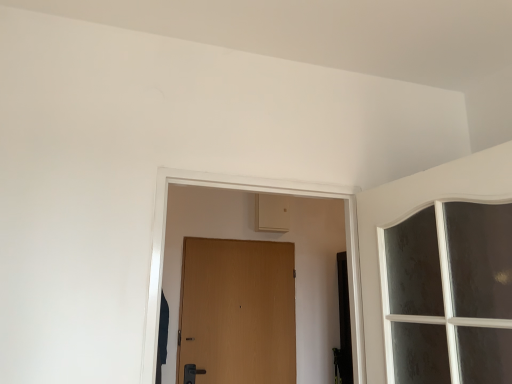
Locate an element on the screen. The image size is (512, 384). wooden door at center is located at coordinates (238, 311).

Describe the element at coordinates (238, 311) in the screenshot. The height and width of the screenshot is (384, 512). I see `wooden door at center` at that location.

Where is `white textured glass window at upper right`? The height and width of the screenshot is (384, 512). white textured glass window at upper right is located at coordinates (449, 295).

Describe the element at coordinates (449, 295) in the screenshot. I see `white textured glass window at upper right` at that location.

Where is `wooden door at center`? The height and width of the screenshot is (384, 512). wooden door at center is located at coordinates (238, 311).

Between wooden door at center and white textured glass window at upper right, which one appears on the right side from the viewer's perspective?

white textured glass window at upper right.

Which object is further away from the camera taking this photo, wooden door at center or white textured glass window at upper right?

wooden door at center is more distant.

Is point (294, 328) behind point (397, 296)?

Yes, it is.

From the image's perspective, which is below, wooden door at center or white textured glass window at upper right?

wooden door at center.

Consider the image. From a real-world perspective, relative to white textured glass window at upper right, is wooden door at center vertically above or below?

wooden door at center is below white textured glass window at upper right.

In the scene shown: Looking at their sizes, would you say wooden door at center is wider or thinner than white textured glass window at upper right?

In the image, wooden door at center appears to be more narrow than white textured glass window at upper right.

Looking at this image, who is shorter, wooden door at center or white textured glass window at upper right?

white textured glass window at upper right is shorter.

Between wooden door at center and white textured glass window at upper right, which one has larger size?

white textured glass window at upper right.

Choose the correct answer: Is wooden door at center inside white textured glass window at upper right or outside it?

wooden door at center is not enclosed by white textured glass window at upper right.

Would you consider wooden door at center to be distant from white textured glass window at upper right?

Yes, wooden door at center and white textured glass window at upper right are located far from each other.

Does wooden door at center turn towards white textured glass window at upper right?

Yes.

Measure the distance between wooden door at center and white textured glass window at upper right.

6.86 feet.

This screenshot has width=512, height=384. Find the location of `door below the white textured glass window at upper right (from the image's perspective)`. door below the white textured glass window at upper right (from the image's perspective) is located at coordinates (238, 311).

Is white textured glass window at upper right to the left of wooden door at center from the viewer's perspective?

Incorrect, white textured glass window at upper right is not on the left side of wooden door at center.

Relative to wooden door at center, is white textured glass window at upper right in front or behind?

Clearly, white textured glass window at upper right is in front of wooden door at center.

Which point is more forward, [407,351] or [238,287]?

Point [407,351]

From the image's perspective, is white textured glass window at upper right located above or below wooden door at center?

Clearly, from the image's perspective, white textured glass window at upper right is above wooden door at center.

From a real-world perspective, between white textured glass window at upper right and wooden door at center, who is vertically lower?

wooden door at center, from a real-world perspective.

Is white textured glass window at upper right thinner than wooden door at center?

No, white textured glass window at upper right is not thinner than wooden door at center.

Who is shorter, white textured glass window at upper right or wooden door at center?

Standing shorter between the two is white textured glass window at upper right.

Which of these two, white textured glass window at upper right or wooden door at center, is smaller?

With smaller size is wooden door at center.

Is white textured glass window at upper right completely or partially outside of wooden door at center?

Yes, white textured glass window at upper right is located beyond the bounds of wooden door at center.

Looking at this image, does white textured glass window at upper right touch wooden door at center?

No, white textured glass window at upper right is not with wooden door at center.

Is white textured glass window at upper right aimed at wooden door at center?

No, white textured glass window at upper right is not aimed at wooden door at center.

How much distance is there between white textured glass window at upper right and wooden door at center?

white textured glass window at upper right and wooden door at center are 6.86 feet apart from each other.

This screenshot has height=384, width=512. I want to click on window to the right of wooden door at center, so click(449, 295).

Locate an element on the screen. This screenshot has height=384, width=512. door below the white textured glass window at upper right (from a real-world perspective) is located at coordinates (238, 311).

At what (x,y) coordinates should I click in order to perform the action: click on window above the wooden door at center (from a real-world perspective). Please return your answer as a coordinate pair (x, y). Looking at the image, I should click on (449, 295).